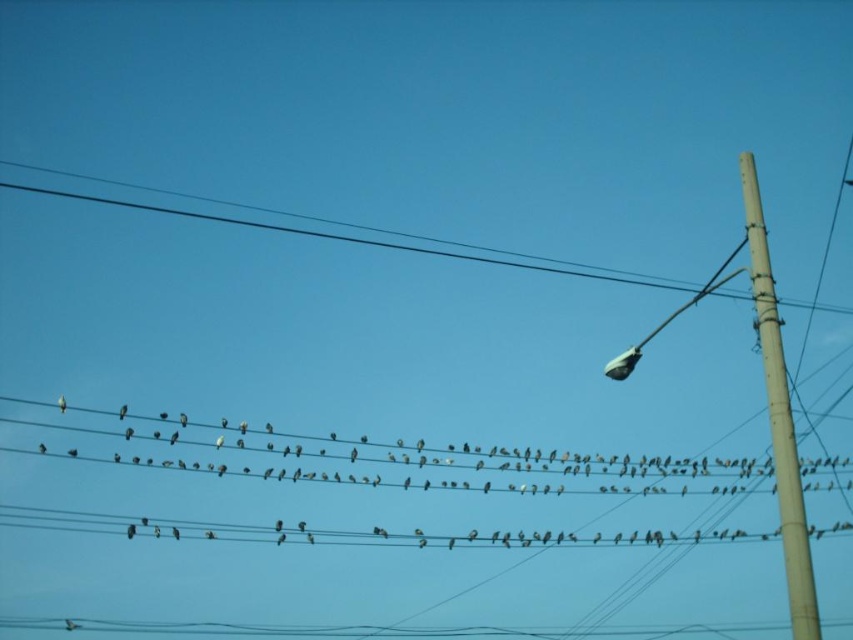
In the scene with the clear blue sky and power lines, there is a smooth beige pole at right and a gray matte bird at center. From the perspective of an observer looking at the image, which object is positioned to the right of the other?

The smooth beige pole at right is to the right of the gray matte bird at center.

You are a birdwatcher observing the scene. You notice two birds on the power lines. The white matte bird at center and the gray matte bird at center. Which bird is bigger?

The white matte bird at center is larger in size compared to the gray matte bird at center.

You are a bird trying to land on the smooth beige pole at right. The nearest bird on the power line is 74.85 meters away from the pole. Can you safely land on the pole without being too close to the bird?

The nearest bird on the power line is 74.85 meters away from the smooth beige pole at right. Since birds typically maintain a distance of about 1 meter between each other to avoid collisions, 74.85 meters is far enough for safe landing.